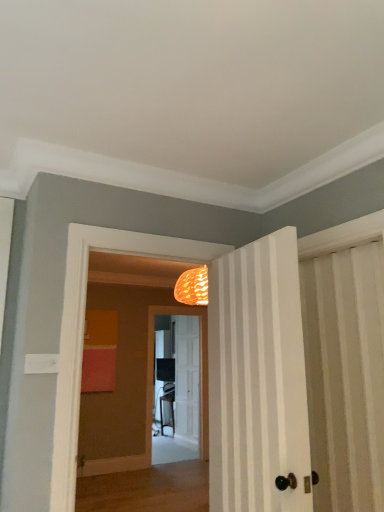
Locate an element on the screen. white striped door at center, which ranks as the first door in top-to-bottom order is located at coordinates (257, 378).

I want to click on door lying on the left of white striped door at center, which appears as the first door when viewed from the front, so click(186, 377).

Considering the sizes of objects white wooden door at center, the 1th door positioned from the bottom, and white striped door at center, which is the first door in right-to-left order, in the image provided, who is smaller, white wooden door at center, the 1th door positioned from the bottom, or white striped door at center, which is the first door in right-to-left order,?

white wooden door at center, the 1th door positioned from the bottom, is smaller.

Is white wooden door at center, the second door when ordered from front to back, outside of white striped door at center, the 2th door positioned from the bottom?

That's correct, white wooden door at center, the second door when ordered from front to back, is outside of white striped door at center, the 2th door positioned from the bottom.

Looking at this image, between white wooden door at center, which is the second door from right to left, and white striped door at center, the 2th door when ordered from back to front, which one has less height?

A: white striped door at center, the 2th door when ordered from back to front, is shorter.

Is white striped door at center, which ranks as the first door in top-to-bottom order, looking in the opposite direction of matte black screen door at center?

white striped door at center, which ranks as the first door in top-to-bottom order, is not turned away from matte black screen door at center.

Is white striped door at center, the 2th door positioned from the bottom, thinner than matte black screen door at center?

No, white striped door at center, the 2th door positioned from the bottom, is not thinner than matte black screen door at center.

Considering the sizes of objects matte black screen door at center and white striped door at center, which appears as the first door when viewed from the front, in the image provided, who is wider, matte black screen door at center or white striped door at center, which appears as the first door when viewed from the front,?

With larger width is white striped door at center, which appears as the first door when viewed from the front.

Are matte black screen door at center and white striped door at center, which ranks as the first door in top-to-bottom order, far apart?

Yes, matte black screen door at center is far from white striped door at center, which ranks as the first door in top-to-bottom order.

Is matte black screen door at center oriented away from white striped door at center, the 2th door when ordered from back to front?

No, matte black screen door at center's orientation is not away from white striped door at center, the 2th door when ordered from back to front.

From a real-world perspective, relative to white striped door at center, which ranks as the first door in top-to-bottom order, is matte black screen door at center vertically above or below?

matte black screen door at center is situated lower than white striped door at center, which ranks as the first door in top-to-bottom order, in the real world.

Do you think white wooden door at center, which is the second door from right to left, is within matte black screen door at center, or outside of it?

white wooden door at center, which is the second door from right to left, is located beyond the bounds of matte black screen door at center.

From the image's perspective, which one is positioned higher, white wooden door at center, the second door when ordered from front to back, or matte black screen door at center?

matte black screen door at center, from the image's perspective.

Identify the location of screen door above the white wooden door at center, which is the second door from right to left (from the image's perspective). This screenshot has height=512, width=384. (199, 380).

Considering the sizes of white wooden door at center, acting as the first door starting from the left, and matte black screen door at center in the image, is white wooden door at center, acting as the first door starting from the left, wider or thinner than matte black screen door at center?

Considering their sizes, white wooden door at center, acting as the first door starting from the left, looks slimmer than matte black screen door at center.

Can you confirm if matte black screen door at center is taller than white wooden door at center, which is the second door from right to left?

In fact, matte black screen door at center may be shorter than white wooden door at center, which is the second door from right to left.

From the image's perspective, which object appears higher, matte black screen door at center or white wooden door at center, which is the second door from right to left?

matte black screen door at center.

Is matte black screen door at center smaller than white wooden door at center, acting as the first door starting from the left?

No, matte black screen door at center is not smaller than white wooden door at center, acting as the first door starting from the left.

In the scene shown: Who is more distant, matte black screen door at center or white wooden door at center, marked as the 2th door in a top-to-bottom arrangement?

white wooden door at center, marked as the 2th door in a top-to-bottom arrangement, is behind.

From the picture: Can you confirm if white striped door at center, the second door viewed from the left, is smaller than white wooden door at center, acting as the first door starting from the left?

Incorrect, white striped door at center, the second door viewed from the left, is not smaller in size than white wooden door at center, acting as the first door starting from the left.

Is white striped door at center, the 2th door positioned from the bottom, completely or partially outside of white wooden door at center, the second door when ordered from front to back?

Yes, white striped door at center, the 2th door positioned from the bottom, is outside of white wooden door at center, the second door when ordered from front to back.

Is there a large distance between white striped door at center, the second door viewed from the left, and white wooden door at center, which is the second door from right to left?

That's right, there is a large distance between white striped door at center, the second door viewed from the left, and white wooden door at center, which is the second door from right to left.

Is white striped door at center, the 2th door positioned from the bottom, wider than white wooden door at center, the 1th door positioned from the bottom?

Indeed, white striped door at center, the 2th door positioned from the bottom, has a greater width compared to white wooden door at center, the 1th door positioned from the bottom.

Where is `door in front of the white wooden door at center, the second door when ordered from front to back`? door in front of the white wooden door at center, the second door when ordered from front to back is located at coordinates (257, 378).

Locate an element on the screen. Image resolution: width=384 pixels, height=512 pixels. screen door below the white striped door at center, the 2th door when ordered from back to front (from the image's perspective) is located at coordinates (199, 380).

Looking at the image, which one is located closer to white striped door at center, which is the first door in right-to-left order, matte black screen door at center or white wooden door at center, acting as the first door starting from the back?

Among the two, matte black screen door at center is located nearer to white striped door at center, which is the first door in right-to-left order.

Estimate the real-world distances between objects in this image. Which object is closer to white striped door at center, the second door viewed from the left, white wooden door at center, the 1th door positioned from the bottom, or matte black screen door at center?

matte black screen door at center is closer to white striped door at center, the second door viewed from the left.

Looking at the image, which one is located closer to white wooden door at center, the 1th door positioned from the bottom, white striped door at center, the second door viewed from the left, or matte black screen door at center?

Based on the image, matte black screen door at center appears to be nearer to white wooden door at center, the 1th door positioned from the bottom.

Based on their spatial positions, is matte black screen door at center or white striped door at center, which is the first door in right-to-left order, closer to white wooden door at center, acting as the first door starting from the back?

matte black screen door at center lies closer to white wooden door at center, acting as the first door starting from the back, than the other object.

Consider the image. From the image, which object appears to be nearer to matte black screen door at center, white wooden door at center, the 1th door positioned from the bottom, or white striped door at center, which ranks as the first door in top-to-bottom order?

The object closer to matte black screen door at center is white wooden door at center, the 1th door positioned from the bottom.

From the image, which object appears to be farther from matte black screen door at center, white striped door at center, the 2th door when ordered from back to front, or white wooden door at center, marked as the 2th door in a top-to-bottom arrangement?

Among the two, white striped door at center, the 2th door when ordered from back to front, is located further to matte black screen door at center.

Where is `screen door located between white striped door at center, which appears as the first door when viewed from the front, and white wooden door at center, the 1th door positioned from the bottom, in the depth direction`? The width and height of the screenshot is (384, 512). screen door located between white striped door at center, which appears as the first door when viewed from the front, and white wooden door at center, the 1th door positioned from the bottom, in the depth direction is located at coordinates (199, 380).